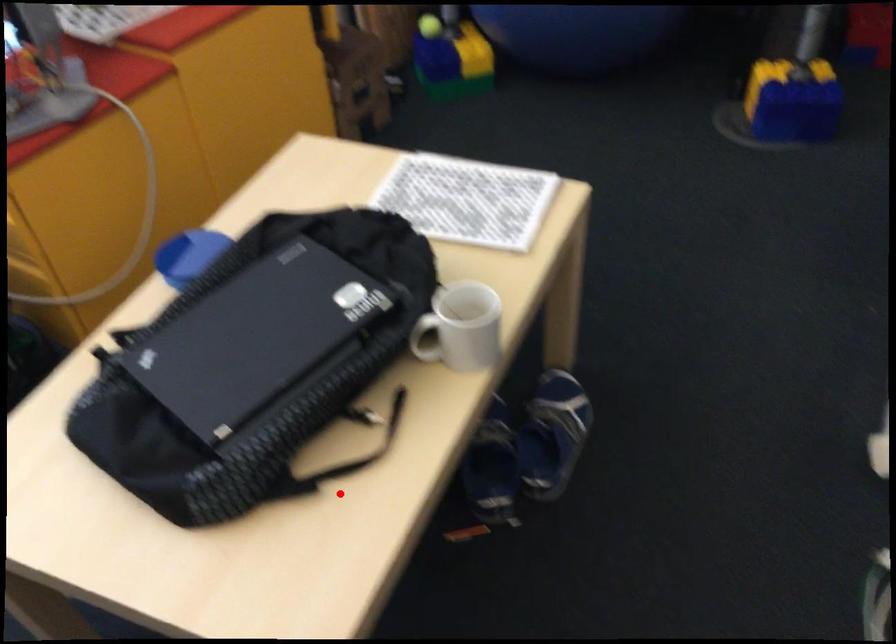
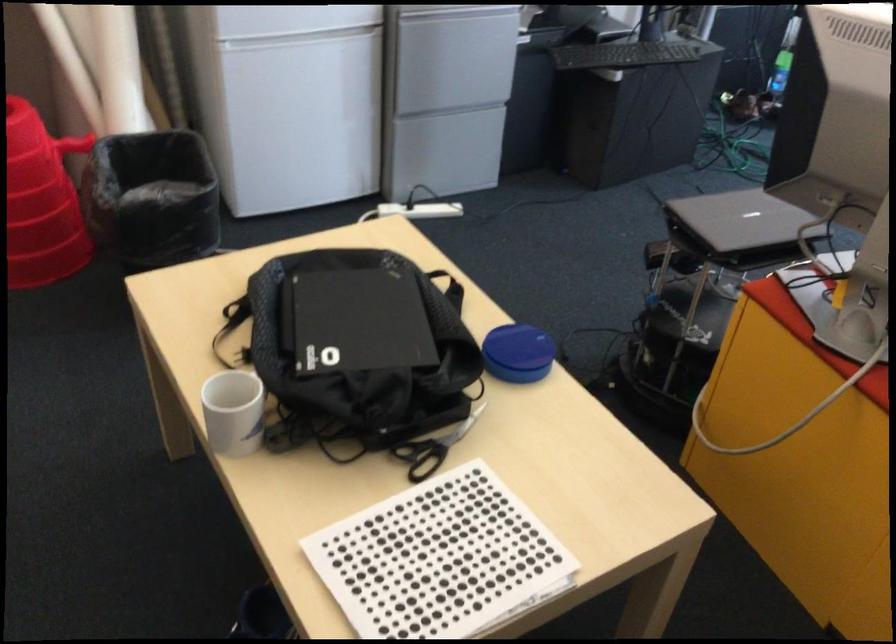
The point at the highlighted location is marked in the first image. Where is the corresponding point in the second image?

(229, 325)